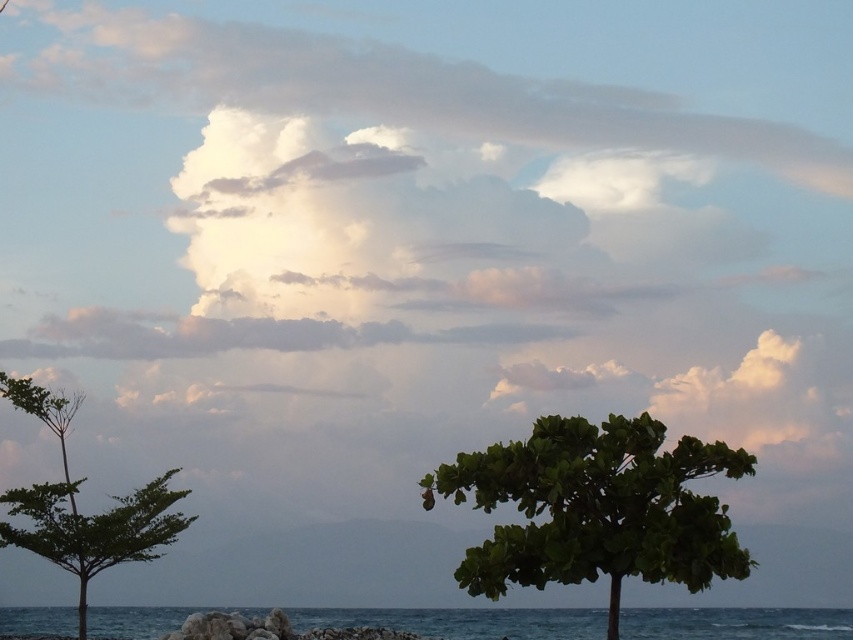
Question: Which object is positioned closest to the white fluffy cloud at upper center?

Choices:
 (A) green leafy tree at left
 (B) green leafy tree at center

Answer: (A)

Question: Does blue water at lower center appear under smooth gray rock at lower center?

Choices:
 (A) no
 (B) yes

Answer: (B)

Question: Which point is farther from the camera taking this photo?

Choices:
 (A) (193, 630)
 (B) (547, 556)
 (C) (723, 129)
 (D) (62, 397)

Answer: (C)

Question: Does blue water at lower center have a greater width compared to green leafy tree at left?

Choices:
 (A) no
 (B) yes

Answer: (B)

Question: Does green leafy tree at center have a greater width compared to blue water at lower center?

Choices:
 (A) yes
 (B) no

Answer: (B)

Question: Which point is closer to the camera?

Choices:
 (A) smooth gray rock at lower center
 (B) blue water at lower center
 (C) white fluffy cloud at upper center

Answer: (B)